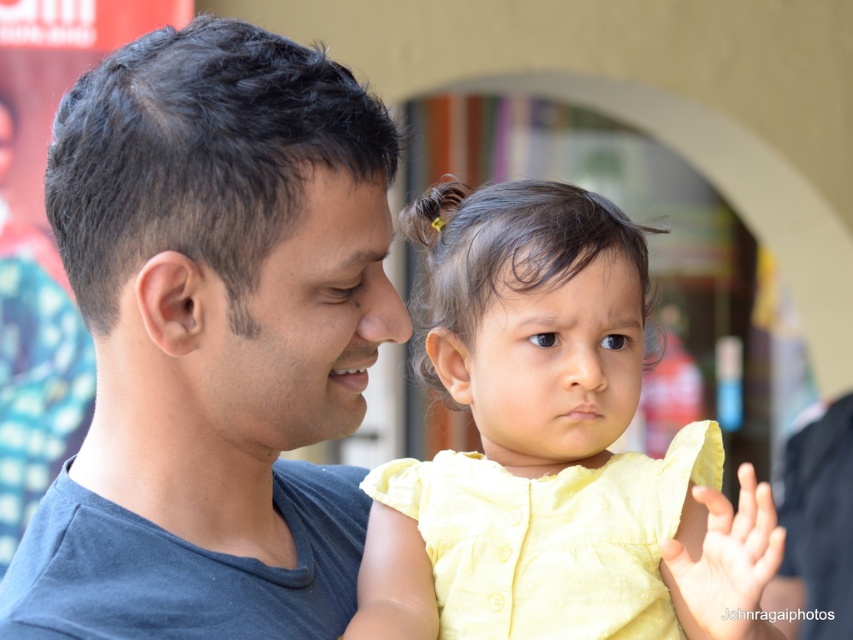
Can you confirm if yellow cotton dress at center is bigger than dark brown hair at center?

Indeed, yellow cotton dress at center has a larger size compared to dark brown hair at center.

Find the location of a particular element. The height and width of the screenshot is (640, 853). yellow cotton dress at center is located at coordinates (552, 448).

This screenshot has height=640, width=853. Describe the element at coordinates (213, 339) in the screenshot. I see `matte gray shirt at left` at that location.

Who is taller, matte gray shirt at left or yellow cotton dress at center?

Standing taller between the two is matte gray shirt at left.

The width and height of the screenshot is (853, 640). Describe the element at coordinates (213, 339) in the screenshot. I see `matte gray shirt at left` at that location.

Find the location of a particular element. The image size is (853, 640). matte gray shirt at left is located at coordinates (213, 339).

Does matte gray shirt at left appear on the right side of dark brown hair at center?

In fact, matte gray shirt at left is to the left of dark brown hair at center.

Between point (219, 228) and point (531, 257), which one is positioned in front?

Point (219, 228)

Between point (180, 33) and point (476, 280), which one is positioned behind?

The point (476, 280) is behind.

Locate an element on the screen. The image size is (853, 640). matte gray shirt at left is located at coordinates (213, 339).